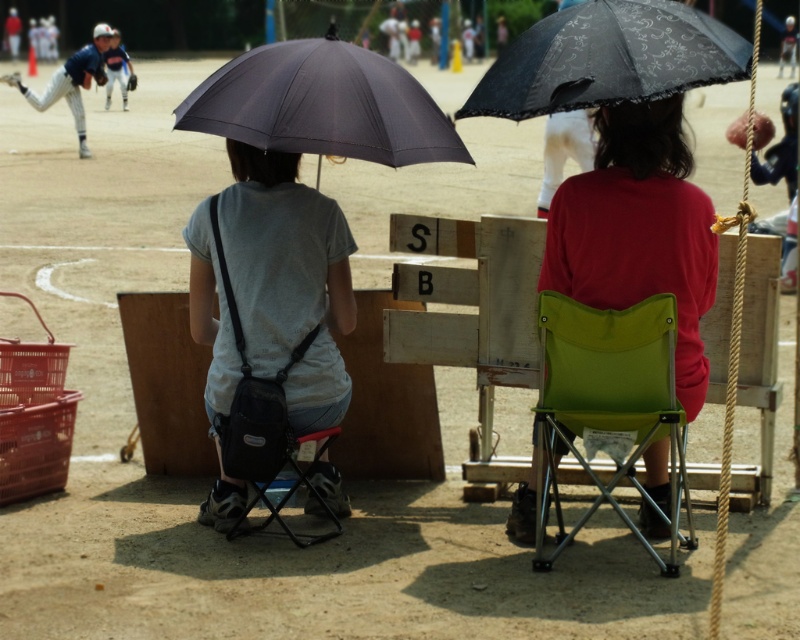
Question: Does black lace umbrella at upper center lie behind blue baseball uniform at upper left?

Choices:
 (A) yes
 (B) no

Answer: (B)

Question: Which object is the closest to the dark gray fabric umbrella at upper center?

Choices:
 (A) matte red shirt at center
 (B) blue baseball uniform at upper left
 (C) white fabric umbrella at upper center

Answer: (B)

Question: Which of the following is the closest to the observer?

Choices:
 (A) (558, 132)
 (B) (280, 108)
 (C) (120, 56)

Answer: (B)

Question: Is matte blue baseball uniform at upper left bigger than matte blue baseball glove at upper left?

Choices:
 (A) yes
 (B) no

Answer: (A)

Question: Which of the following is the farthest from the observer?

Choices:
 (A) black lace umbrella at upper center
 (B) matte gray shirt at center

Answer: (B)

Question: Does green fabric folding chair at center have a larger size compared to white fabric umbrella at upper center?

Choices:
 (A) yes
 (B) no

Answer: (B)